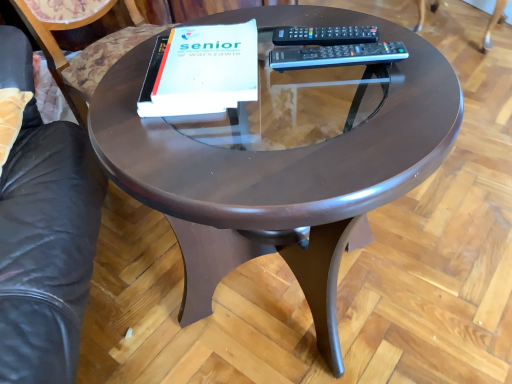
Question: Is wooden swivel chair at upper right positioned with its back to shiny brown table at center?

Choices:
 (A) no
 (B) yes

Answer: (A)

Question: Is wooden swivel chair at upper right at the left side of shiny brown table at center?

Choices:
 (A) no
 (B) yes

Answer: (A)

Question: From the image's perspective, is wooden swivel chair at upper right on shiny brown table at center?

Choices:
 (A) yes
 (B) no

Answer: (A)

Question: Considering the relative sizes of wooden swivel chair at upper right and shiny brown table at center in the image provided, is wooden swivel chair at upper right shorter than shiny brown table at center?

Choices:
 (A) yes
 (B) no

Answer: (B)

Question: Does wooden swivel chair at upper right touch shiny brown table at center?

Choices:
 (A) no
 (B) yes

Answer: (A)

Question: Is white matte paper at center taller or shorter than black plastic remote at upper right, the first remote from the back?

Choices:
 (A) short
 (B) tall

Answer: (B)

Question: In terms of size, does white matte paper at center appear bigger or smaller than black plastic remote at upper right, the first remote from the back?

Choices:
 (A) small
 (B) big

Answer: (B)

Question: Is white matte paper at center in front of or behind black plastic remote at upper right, the first remote from the back, in the image?

Choices:
 (A) front
 (B) behind

Answer: (A)

Question: Considering the positions of white matte paper at center and black plastic remote at upper right, the first remote from the back, in the image, is white matte paper at center wider or thinner than black plastic remote at upper right, the first remote from the back,?

Choices:
 (A) wide
 (B) thin

Answer: (B)

Question: Is wooden swivel chair at upper right in front of or behind black plastic remote at upper right, the first remote from the back, in the image?

Choices:
 (A) front
 (B) behind

Answer: (B)

Question: Considering the positions of wooden swivel chair at upper right and black plastic remote at upper right, the first remote from the back, in the image, is wooden swivel chair at upper right taller or shorter than black plastic remote at upper right, the first remote from the back,?

Choices:
 (A) short
 (B) tall

Answer: (B)

Question: Considering the positions of wooden swivel chair at upper right and black plastic remote at upper right, the second remote viewed from the front, in the image, is wooden swivel chair at upper right wider or thinner than black plastic remote at upper right, the second remote viewed from the front,?

Choices:
 (A) wide
 (B) thin

Answer: (A)

Question: Is wooden swivel chair at upper right inside or outside of black plastic remote at upper right, the second remote viewed from the front?

Choices:
 (A) outside
 (B) inside

Answer: (A)

Question: From a real-world perspective, is black plastic remote at upper right, the first remote in the top-to-bottom sequence, positioned above or below white matte paper at center?

Choices:
 (A) above
 (B) below

Answer: (B)

Question: Is black plastic remote at upper right, the first remote in the top-to-bottom sequence, to the left or to the right of white matte paper at center in the image?

Choices:
 (A) right
 (B) left

Answer: (A)